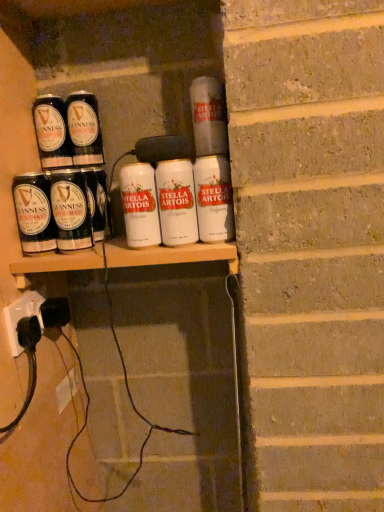
Question: From a real-world perspective, is white matte tin can at upper center, the seventh tin can positioned from the left, below white matte tin can at center, which ranks as the fourth tin can in right-to-left order?

Choices:
 (A) yes
 (B) no

Answer: (B)

Question: Is the position of white matte tin can at upper center, the second tin can viewed from the right, more distant than that of white matte tin can at center, the fifth tin can when ordered from left to right?

Choices:
 (A) yes
 (B) no

Answer: (B)

Question: Is white matte tin can at upper center, the second tin can viewed from the right, wider than white matte tin can at center, which ranks as the fourth tin can in right-to-left order?

Choices:
 (A) no
 (B) yes

Answer: (B)

Question: Is white matte tin can at upper center, the second tin can viewed from the right, bigger than white matte tin can at center, which ranks as the fourth tin can in right-to-left order?

Choices:
 (A) no
 (B) yes

Answer: (A)

Question: From the image's perspective, is white matte tin can at upper center, the second tin can viewed from the right, beneath white matte tin can at center, which ranks as the fourth tin can in right-to-left order?

Choices:
 (A) yes
 (B) no

Answer: (B)

Question: Choose the correct answer: Is matte black guinness can at upper left, arranged as the 1th tin can when viewed from the left, inside white plastic socket at lower left or outside it?

Choices:
 (A) inside
 (B) outside

Answer: (B)

Question: Considering the relative positions of matte black guinness can at upper left, placed as the 8th tin can when sorted from right to left, and white plastic socket at lower left in the image provided, is matte black guinness can at upper left, placed as the 8th tin can when sorted from right to left, to the left or to the right of white plastic socket at lower left?

Choices:
 (A) right
 (B) left

Answer: (A)

Question: From the image's perspective, is matte black guinness can at upper left, placed as the 8th tin can when sorted from right to left, above or below white plastic socket at lower left?

Choices:
 (A) below
 (B) above

Answer: (B)

Question: In terms of height, does matte black guinness can at upper left, placed as the 8th tin can when sorted from right to left, look taller or shorter compared to white plastic socket at lower left?

Choices:
 (A) short
 (B) tall

Answer: (B)

Question: Visually, is white matte stella artois can at center, the 1th tin can positioned from the right, positioned to the left or to the right of shiny black can at left, positioned as the 5th tin can in right-to-left order?

Choices:
 (A) left
 (B) right

Answer: (B)

Question: From the image's perspective, is white matte stella artois can at center, the eighth tin can when ordered from left to right, located above or below shiny black can at left, placed as the fourth tin can when sorted from left to right?

Choices:
 (A) above
 (B) below

Answer: (B)

Question: Is white matte stella artois can at center, the 1th tin can positioned from the right, situated inside shiny black can at left, placed as the fourth tin can when sorted from left to right, or outside?

Choices:
 (A) inside
 (B) outside

Answer: (B)

Question: From a real-world perspective, is white matte stella artois can at center, the 1th tin can positioned from the right, positioned above or below shiny black can at left, positioned as the 5th tin can in right-to-left order?

Choices:
 (A) below
 (B) above

Answer: (A)

Question: Is matte black can at left, which is the 3th tin can in left-to-right order, to the left or to the right of matte black guinness can at upper left, arranged as the 1th tin can when viewed from the left, in the image?

Choices:
 (A) right
 (B) left

Answer: (A)

Question: Looking at their shapes, would you say matte black can at left, which is the 3th tin can in left-to-right order, is wider or thinner than matte black guinness can at upper left, placed as the 8th tin can when sorted from right to left?

Choices:
 (A) thin
 (B) wide

Answer: (A)